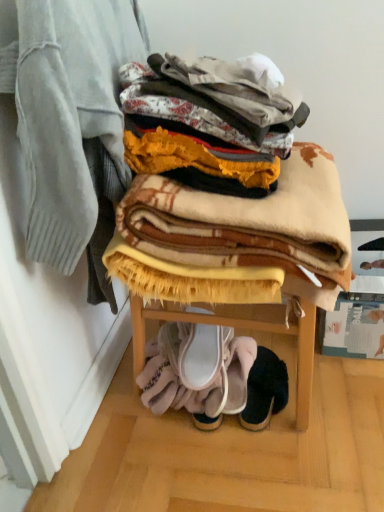
The height and width of the screenshot is (512, 384). Find the location of `free location to the left of white fabric slipper at lower center, positioned as the third footwear in right-to-left order`. free location to the left of white fabric slipper at lower center, positioned as the third footwear in right-to-left order is located at coordinates (170, 351).